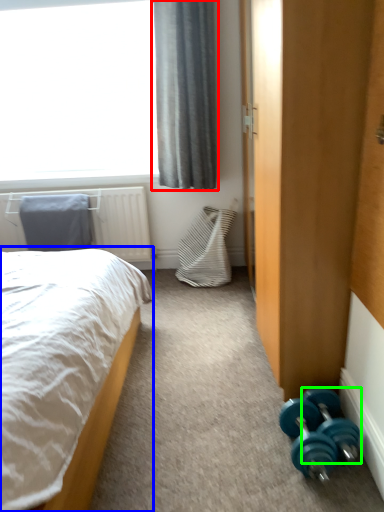
Question: Considering the real-world distances, which object is farthest from curtain (highlighted by a red box)? bed (highlighted by a blue box) or dumbbell (highlighted by a green box)?

Choices:
 (A) bed
 (B) dumbbell

Answer: (B)